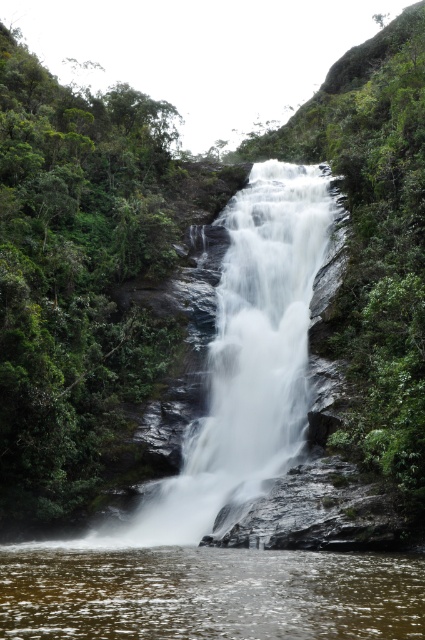
You are standing at the edge of the pool below the waterfall. You see the green leafy foliage at left and the clear water at center. Which object is positioned more to the left side of the scene?

The green leafy foliage at left is positioned more to the left side of the scene than the clear water at center.

You are an environmental scientist assessing the vegetation health in the area. You observe the green leafy foliage at left and the white smooth waterfall at center. Which object has a larger size according to the scene?

The green leafy foliage at left has a larger size compared to the white smooth waterfall at center.